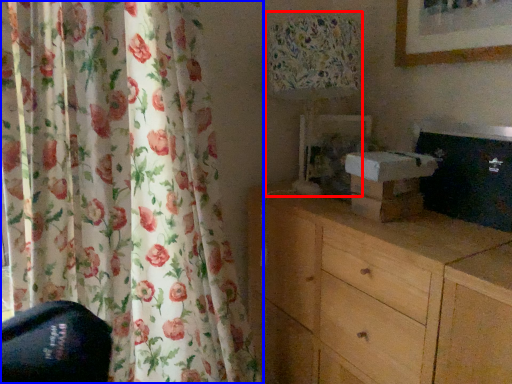
Question: Which object is closer to the camera taking this photo, table lamp (highlighted by a red box) or curtain (highlighted by a blue box)?

Choices:
 (A) table lamp
 (B) curtain

Answer: (B)